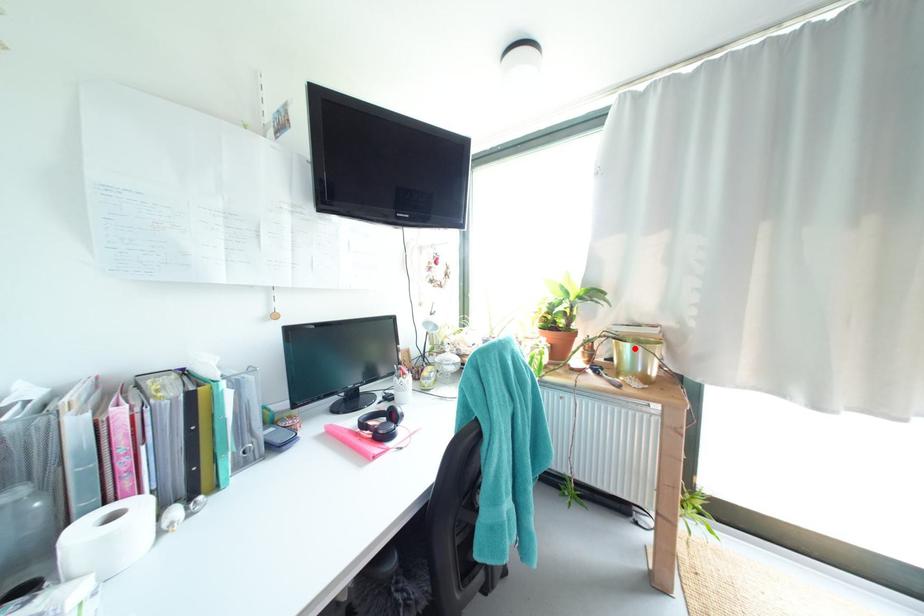
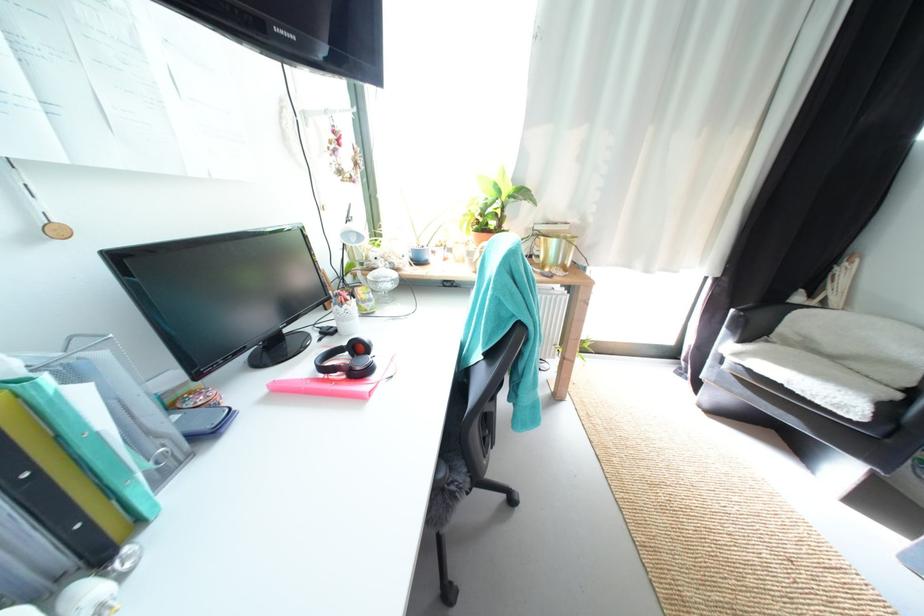
Question: I am providing you with two images of the same scene from different viewpoints. A red point is shown in image1. For the corresponding object point in image2, is it positioned nearer or farther from the camera?

Choices:
 (A) Nearer
 (B) Farther

Answer: (A)